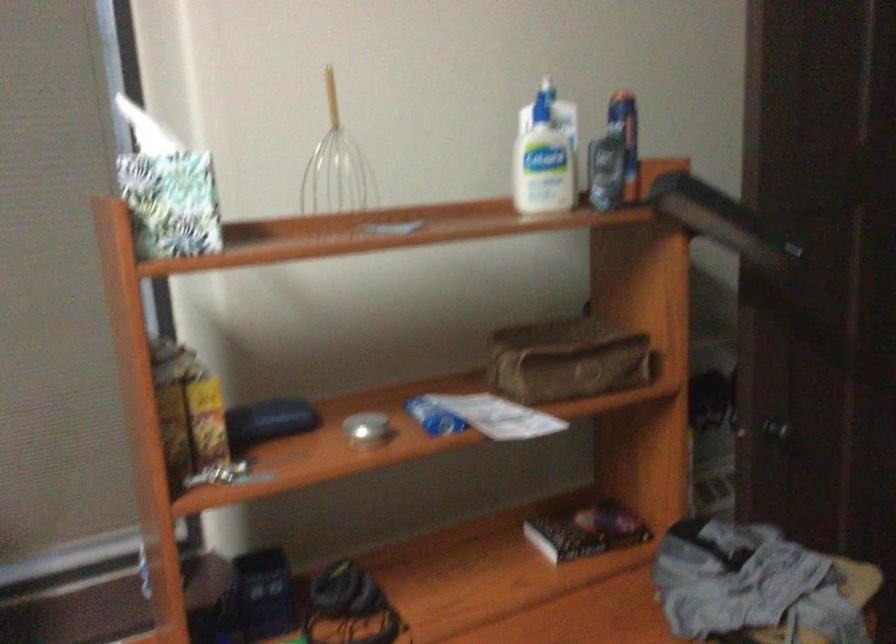
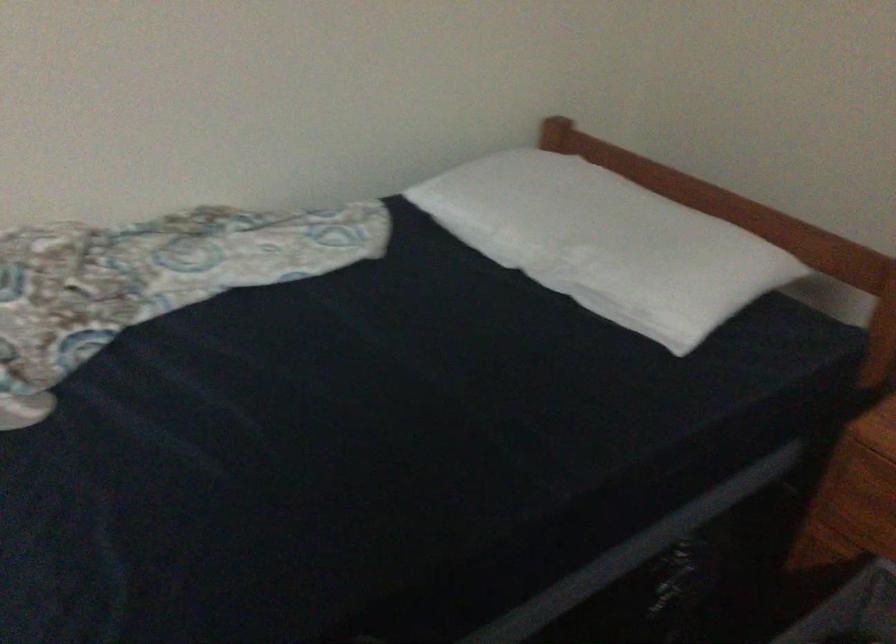
The first image is from the beginning of the video and the second image is from the end. How did the camera likely rotate when shooting the video?

The camera's rotation is toward right-down.